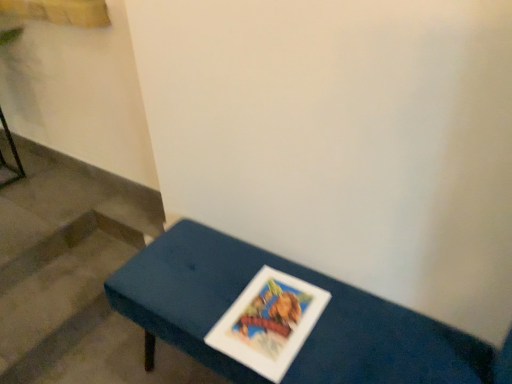
Question: Is blue fabric bench at center taller or shorter than wooden stairs at lower left?

Choices:
 (A) tall
 (B) short

Answer: (A)

Question: From a real-world perspective, relative to wooden stairs at lower left, is blue fabric bench at center vertically above or below?

Choices:
 (A) above
 (B) below

Answer: (A)

Question: Based on their relative distances, which object is farther from the wooden stairs at lower left?

Choices:
 (A) metallic black stool at left
 (B) blue fabric bench at center

Answer: (A)

Question: Which of these objects is positioned closest to the metallic black stool at left?

Choices:
 (A) blue fabric bench at center
 (B) wooden stairs at lower left

Answer: (B)